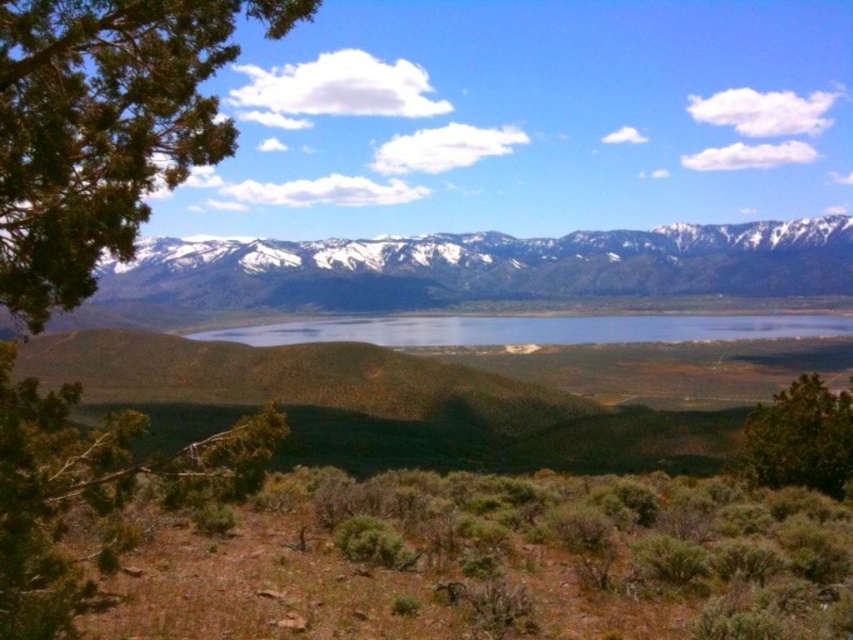
Question: Estimate the real-world distances between objects in this image. Which object is closer to the snowy rock mountain range at upper center?

Choices:
 (A) clear blue water at center
 (B) green leafy tree at lower right
 (C) green leafy tree at left

Answer: (A)

Question: Is snowy rock mountain range at upper center wider than clear blue water at center?

Choices:
 (A) yes
 (B) no

Answer: (A)

Question: Which point is closer to the camera taking this photo?

Choices:
 (A) 119,237
 (B) 740,321
 (C) 816,289
 (D) 831,474

Answer: (A)

Question: Can you confirm if green leafy tree at left is positioned to the right of snowy rock mountain range at upper center?

Choices:
 (A) yes
 (B) no

Answer: (B)

Question: Which of the following is the farthest from the observer?

Choices:
 (A) (91, 211)
 (B) (509, 257)
 (C) (793, 420)

Answer: (B)

Question: Can you confirm if snowy rock mountain range at upper center is smaller than green leafy tree at lower right?

Choices:
 (A) no
 (B) yes

Answer: (A)